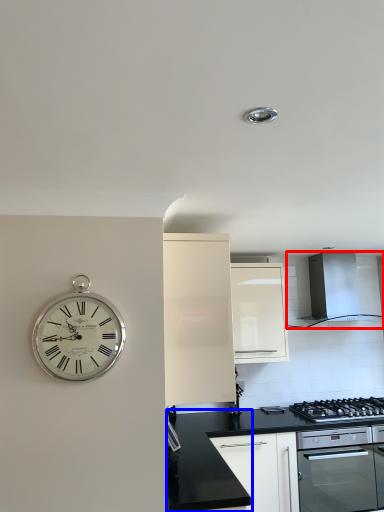
Question: Among these objects, which one is nearest to the camera, home appliance (highlighted by a red box) or counter top (highlighted by a blue box)?

Choices:
 (A) home appliance
 (B) counter top

Answer: (B)